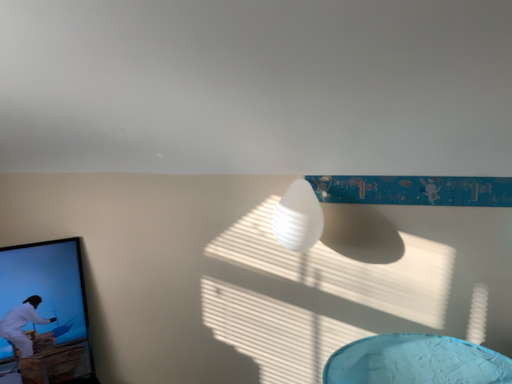
Question: From the image's perspective, is white matte lamp at center above or below black glossy picture frame at left?

Choices:
 (A) above
 (B) below

Answer: (A)

Question: Is point (306, 218) closer or farther from the camera than point (25, 365)?

Choices:
 (A) farther
 (B) closer

Answer: (B)

Question: Choose the correct answer: Is white matte lamp at center inside black glossy picture frame at left or outside it?

Choices:
 (A) outside
 (B) inside

Answer: (A)

Question: Looking at their shapes, would you say black glossy picture frame at left is wider or thinner than white matte lamp at center?

Choices:
 (A) thin
 (B) wide

Answer: (B)

Question: Is point (42, 274) positioned closer to the camera than point (290, 243)?

Choices:
 (A) farther
 (B) closer

Answer: (A)

Question: Is black glossy picture frame at left taller or shorter than white matte lamp at center?

Choices:
 (A) short
 (B) tall

Answer: (B)

Question: Would you say black glossy picture frame at left is to the left or to the right of white matte lamp at center in the picture?

Choices:
 (A) left
 (B) right

Answer: (A)